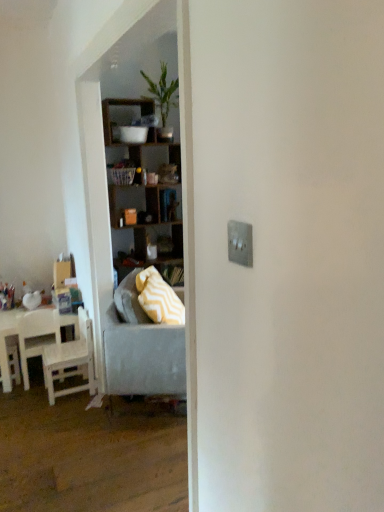
Question: Can you confirm if green leafy plant at upper center is wider than white wood chair at left, marked as the first chair in a right-to-left arrangement?

Choices:
 (A) yes
 (B) no

Answer: (B)

Question: Is green leafy plant at upper center at the right side of white wood chair at left, the second chair viewed from the left?

Choices:
 (A) no
 (B) yes

Answer: (B)

Question: Is green leafy plant at upper center looking in the opposite direction of white wood chair at left, marked as the first chair in a right-to-left arrangement?

Choices:
 (A) no
 (B) yes

Answer: (A)

Question: Can you confirm if green leafy plant at upper center is smaller than white wood chair at left, marked as the first chair in a right-to-left arrangement?

Choices:
 (A) yes
 (B) no

Answer: (B)

Question: From a real-world perspective, is green leafy plant at upper center positioned under white wood chair at left, the second chair viewed from the left, based on gravity?

Choices:
 (A) no
 (B) yes

Answer: (A)

Question: Is white wood chair at left, marked as the first chair in a right-to-left arrangement, located within green leafy plant at upper center?

Choices:
 (A) yes
 (B) no

Answer: (B)

Question: Can you confirm if green leafy plant at upper center is shorter than matte cardboard box at left?

Choices:
 (A) no
 (B) yes

Answer: (A)

Question: Is green leafy plant at upper center to the left of matte cardboard box at left from the viewer's perspective?

Choices:
 (A) yes
 (B) no

Answer: (B)

Question: Is green leafy plant at upper center positioned behind matte cardboard box at left?

Choices:
 (A) no
 (B) yes

Answer: (A)

Question: Is green leafy plant at upper center positioned before matte cardboard box at left?

Choices:
 (A) no
 (B) yes

Answer: (B)

Question: Is green leafy plant at upper center taller than matte cardboard box at left?

Choices:
 (A) yes
 (B) no

Answer: (A)

Question: From a real-world perspective, is green leafy plant at upper center on top of matte cardboard box at left?

Choices:
 (A) yes
 (B) no

Answer: (A)

Question: From the image's perspective, is matte cardboard box at left beneath white wood table at left?

Choices:
 (A) yes
 (B) no

Answer: (B)